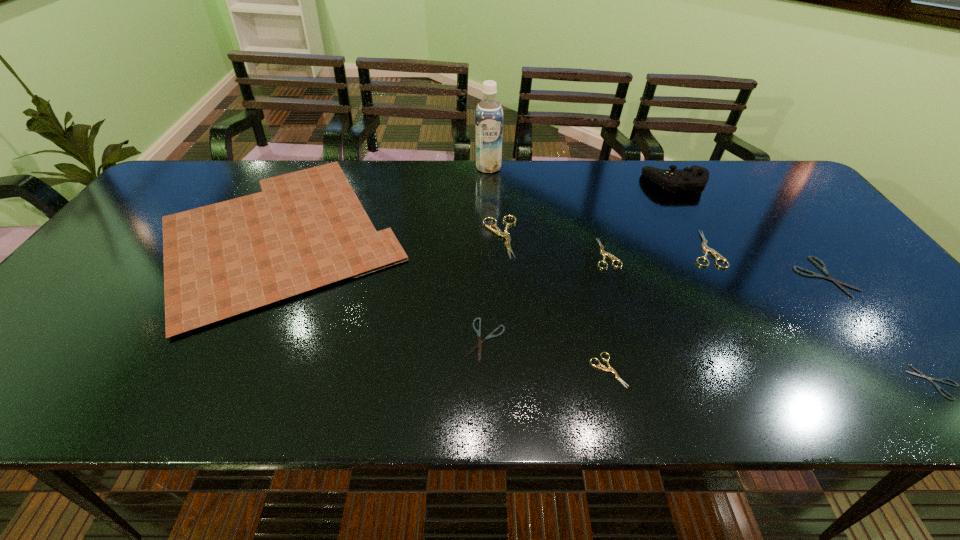
The height and width of the screenshot is (540, 960). Find the location of `free area in between the sixth object from left to right and the tallest object`. free area in between the sixth object from left to right and the tallest object is located at coordinates tap(547, 210).

Image resolution: width=960 pixels, height=540 pixels. In order to click on blank region between the smallest beige shears and the third tallest object in this screenshot , I will do `click(445, 302)`.

At what (x,y) coordinates should I click in order to perform the action: click on vacant area that lies between the biggest black shears and the leftmost beige shears. Please return your answer as a coordinate pair (x, y). Looking at the image, I should click on (662, 257).

Image resolution: width=960 pixels, height=540 pixels. I want to click on free spot between the nearest beige shears and the third tallest object, so click(x=445, y=302).

The height and width of the screenshot is (540, 960). What are the coordinates of `object that is the seventh closest to the second tallest object` in the screenshot? It's located at (938, 387).

You are a GUI agent. You are given a task and a screenshot of the screen. Output one action in this format:
    pyautogui.click(x=<x>, y=<y>)
    Task: Click on the object that is the seventh closest one to the control
    
    Given the screenshot: What is the action you would take?
    pyautogui.click(x=938, y=387)

I want to click on shears that is the closest to the second biggest black shears, so click(610, 369).

This screenshot has height=540, width=960. Identify the location of shears that stands as the closest to the nearest beige shears. (479, 345).

What are the coordinates of `beige shears identified as the third closest to the sixth shortest shears` in the screenshot? It's located at (505, 234).

The height and width of the screenshot is (540, 960). I want to click on beige shears object that ranks as the second closest to the fifth tallest object, so click(610, 369).